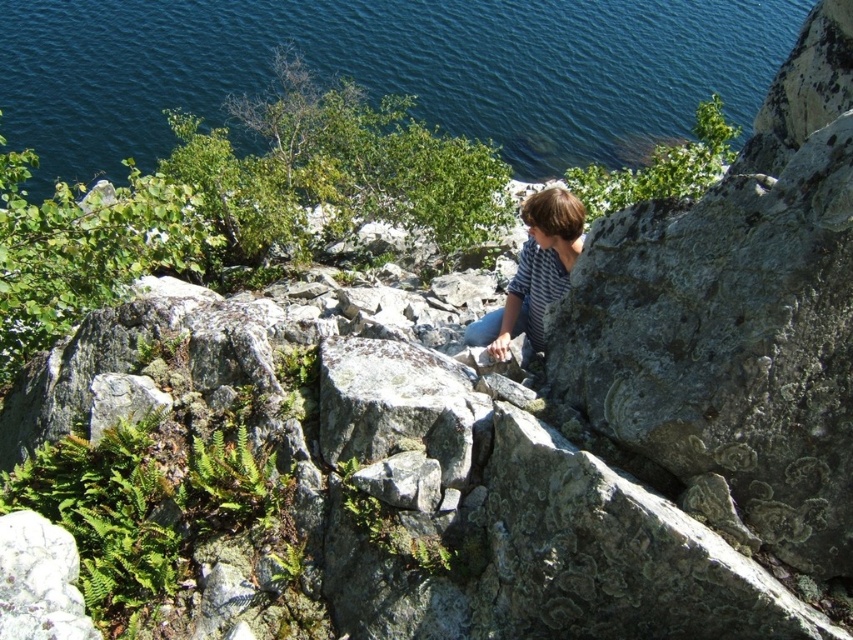
Which is more to the left, blue water at upper center or striped cotton shirt at center?

striped cotton shirt at center

Consider the image. Is blue water at upper center smaller than striped cotton shirt at center?

Incorrect, blue water at upper center is not smaller in size than striped cotton shirt at center.

Identify the location of blue water at upper center. (387, 68).